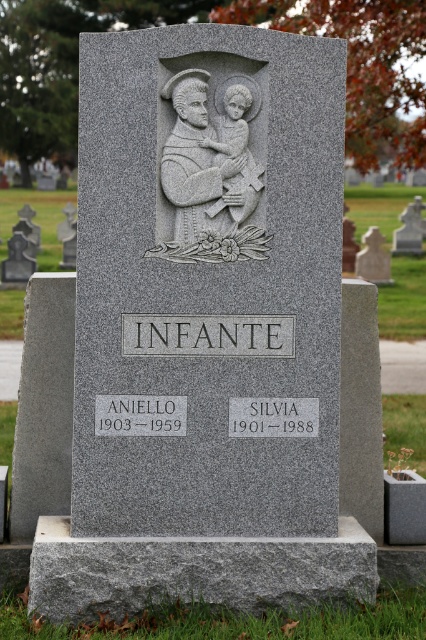
Which is below, gray stone sculpture of man holding child at center or granite gravestone at center?

gray stone sculpture of man holding child at center is lower down.

Measure the distance between gray stone sculpture of man holding child at center and granite gravestone at center.

gray stone sculpture of man holding child at center and granite gravestone at center are 8.97 meters apart from each other.

Does point (175, 202) lie behind point (397, 252)?

No.

Where is `gray stone sculpture of man holding child at center`? The image size is (426, 640). gray stone sculpture of man holding child at center is located at coordinates (210, 168).

Does gray granite statue at upper center appear over granite gravestone at center?

Incorrect, gray granite statue at upper center is not positioned above granite gravestone at center.

Who is positioned more to the left, gray granite statue at upper center or granite gravestone at center?

From the viewer's perspective, gray granite statue at upper center appears more on the left side.

Between point (28, 227) and point (420, 220), which one is positioned in front?

Point (420, 220)

Where is `gray granite statue at upper center`? gray granite statue at upper center is located at coordinates (22, 248).

Who is more distant from viewer, (181,104) or (9,259)?

Positioned behind is point (9,259).

The image size is (426, 640). Describe the element at coordinates (210, 168) in the screenshot. I see `gray stone sculpture of man holding child at center` at that location.

Locate an element on the screen. This screenshot has height=640, width=426. gray stone sculpture of man holding child at center is located at coordinates (210, 168).